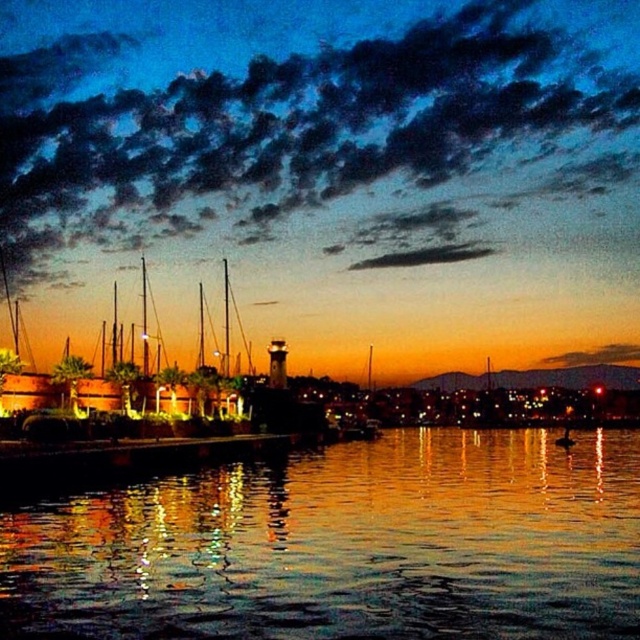
Question: Is reflective glass water at center to the right of wooden dock at left from the viewer's perspective?

Choices:
 (A) no
 (B) yes

Answer: (B)

Question: Can you confirm if reflective glass water at center is bigger than wooden dock at left?

Choices:
 (A) yes
 (B) no

Answer: (B)

Question: Which object is closer to the camera taking this photo?

Choices:
 (A) wooden dock at left
 (B) reflective glass water at center

Answer: (B)

Question: Which object is closer to the camera taking this photo?

Choices:
 (A) wooden dock at left
 (B) reflective glass water at center

Answer: (B)

Question: Can you confirm if reflective glass water at center is bigger than wooden dock at left?

Choices:
 (A) yes
 (B) no

Answer: (B)